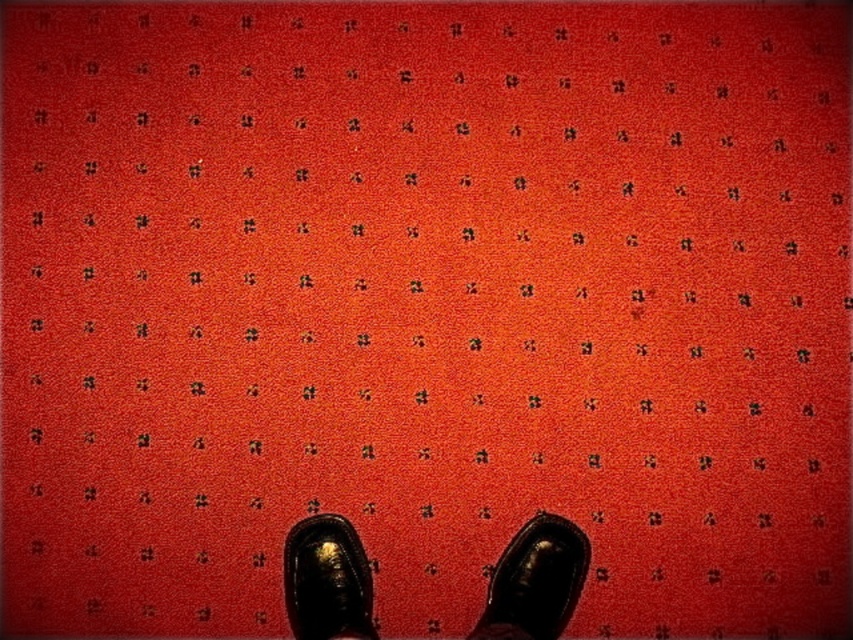
Question: Considering the real-world distances, which object is closest to the shiny black shoe at lower center?

Choices:
 (A) shiny black shoes at center
 (B) shiny black shoe at center

Answer: (A)

Question: Which of the following is the farthest from the observer?

Choices:
 (A) shiny black shoe at center
 (B) shiny black shoe at lower center

Answer: (A)

Question: Considering the relative positions of shiny black shoes at center and shiny black shoe at center in the image provided, where is shiny black shoes at center located with respect to shiny black shoe at center?

Choices:
 (A) below
 (B) above

Answer: (B)

Question: Which point is farther to the camera?

Choices:
 (A) (323, 554)
 (B) (518, 534)

Answer: (B)

Question: Is shiny black shoe at center in front of shiny black shoe at lower center?

Choices:
 (A) no
 (B) yes

Answer: (A)

Question: Is shiny black shoes at center thinner than shiny black shoe at lower center?

Choices:
 (A) yes
 (B) no

Answer: (B)